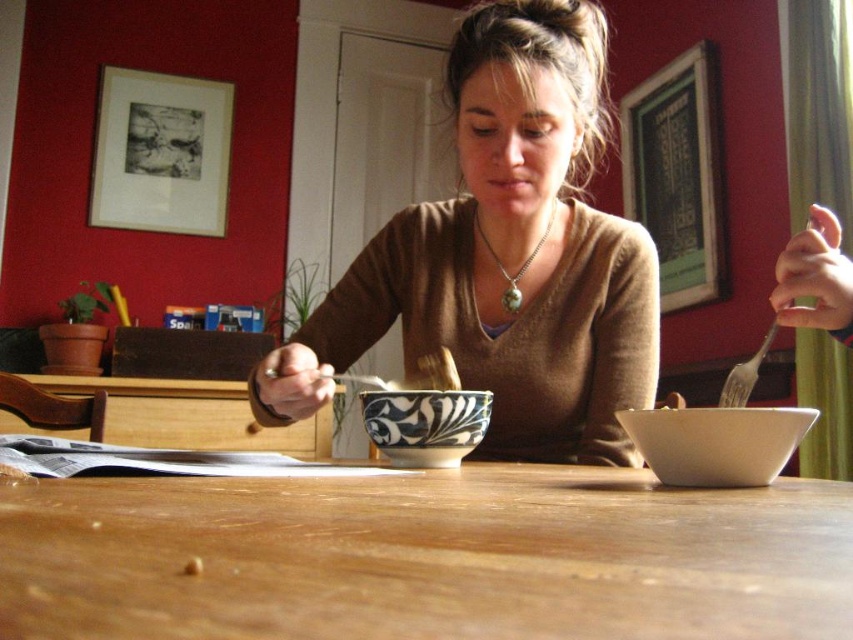
Can you confirm if white matte bowl at center is positioned to the right of black and white ceramic bowl at center?

Indeed, white matte bowl at center is positioned on the right side of black and white ceramic bowl at center.

Is white matte bowl at center positioned behind black and white ceramic bowl at center?

No.

Who is more distant from viewer, (753, 452) or (473, 442)?

Positioned behind is point (473, 442).

I want to click on white matte bowl at center, so click(717, 442).

Who is positioned more to the left, white matte bowl at center or green stone necklace at center?

From the viewer's perspective, green stone necklace at center appears more on the left side.

Between white matte bowl at center and green stone necklace at center, which one has more height?

Standing taller between the two is green stone necklace at center.

Between point (807, 408) and point (498, 272), which one is positioned behind?

Positioned behind is point (498, 272).

Where is `white matte bowl at center`? The height and width of the screenshot is (640, 853). white matte bowl at center is located at coordinates (717, 442).

Is black and white ceramic bowl at center shorter than green stone necklace at center?

Correct, black and white ceramic bowl at center is not as tall as green stone necklace at center.

In the scene shown: Who is shorter, black and white ceramic bowl at center or green stone necklace at center?

With less height is black and white ceramic bowl at center.

Does point (393, 435) come behind point (552, 218)?

No, it is in front of (552, 218).

I want to click on black and white ceramic bowl at center, so click(x=425, y=424).